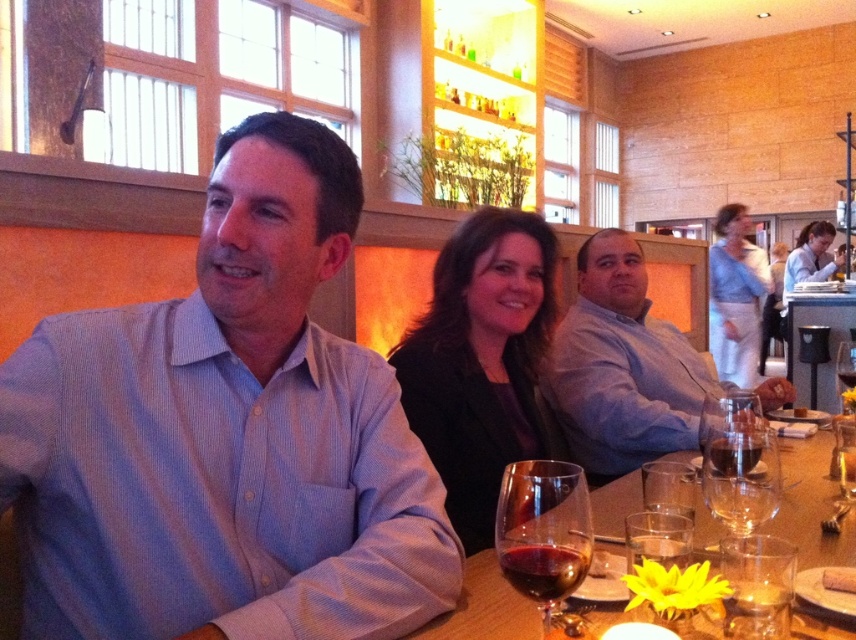
You are a photographer positioned at the center of the room. You want to capture a photo of the light blue striped shirt at left. Where should you aim your camera to ensure the shirt is centered in the frame?

You should aim your camera at point (226,436) to center the light blue striped shirt at left in the frame.

You are a photographer standing 36 inches away from the wooden table. You want to take a closeup photo of the light blue striped shirt at left without moving closer. Can you do it using a zoom lens?

The light blue striped shirt at left is 30.29 inches away from the viewer, which is within the 36 inches distance you are currently at. Therefore, you can take a closeup photo of the light blue striped shirt at left using a zoom lens without moving closer.